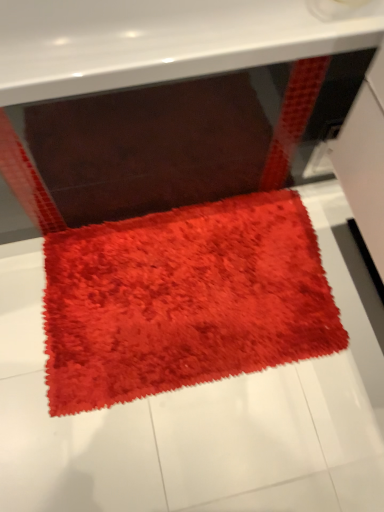
What do you see at coordinates (183, 300) in the screenshot? I see `shaggy red towel at center` at bounding box center [183, 300].

Where is `shaggy red towel at center`? This screenshot has height=512, width=384. shaggy red towel at center is located at coordinates (183, 300).

This screenshot has height=512, width=384. I want to click on shaggy red towel at center, so click(183, 300).